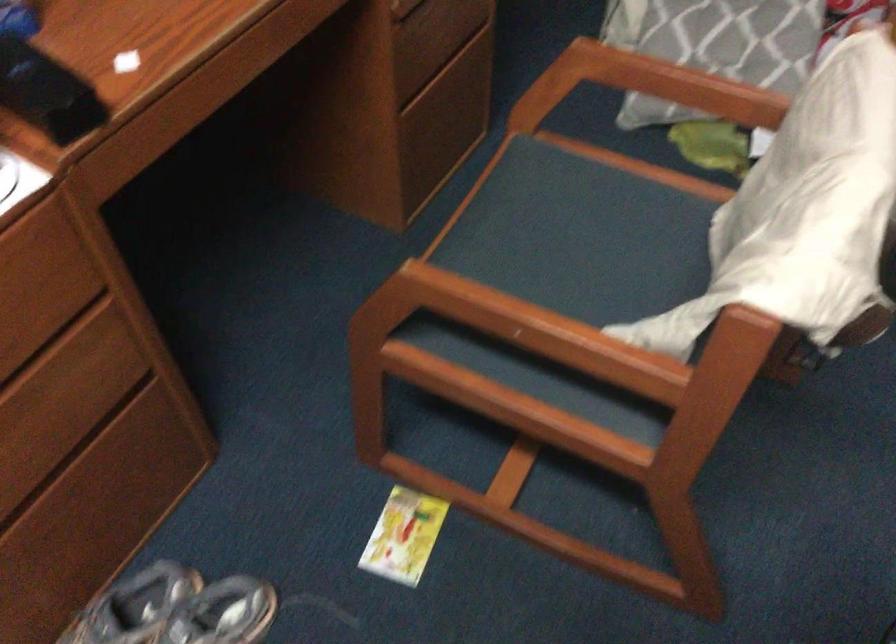
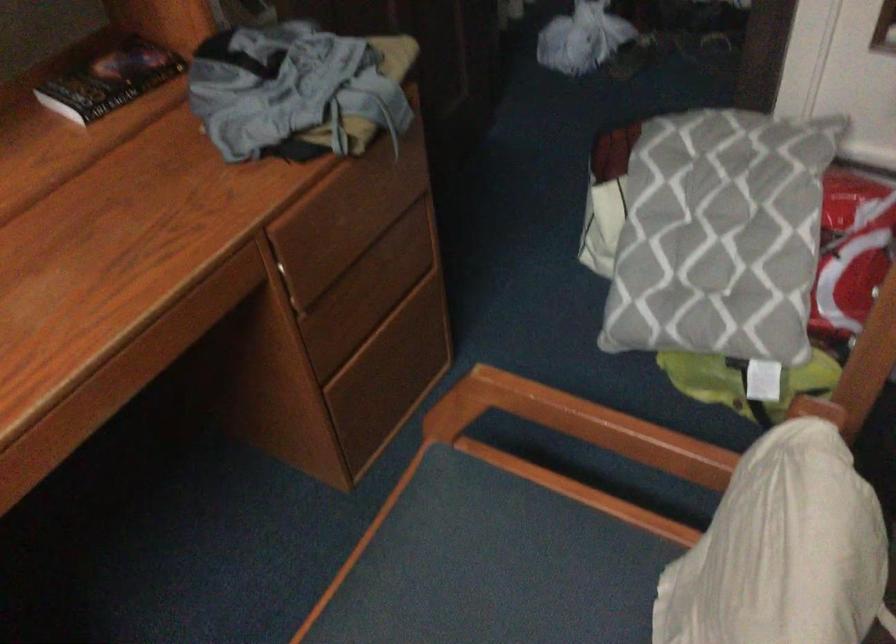
Which direction would the cameraman need to move to produce the second image?

The movement direction of the cameraman is right, forward.